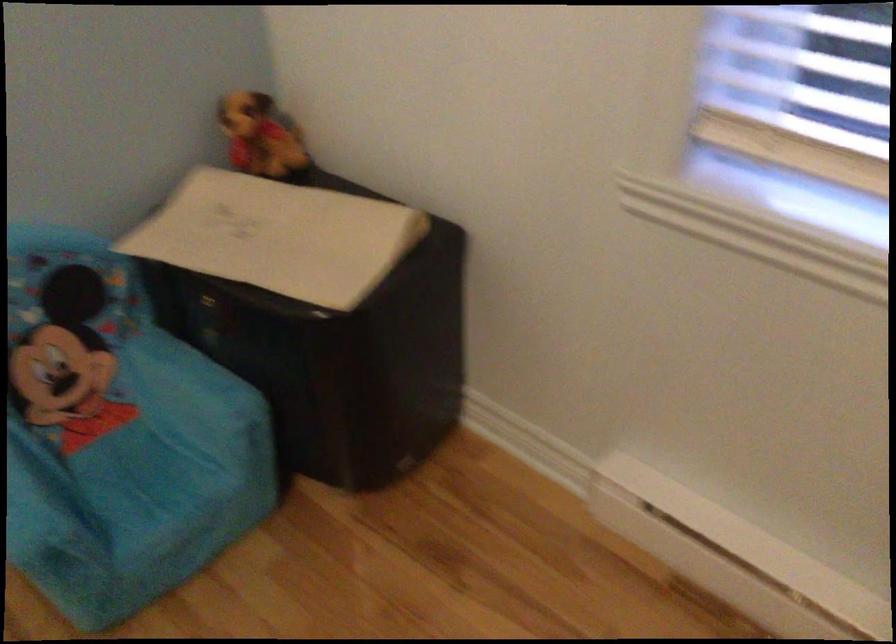
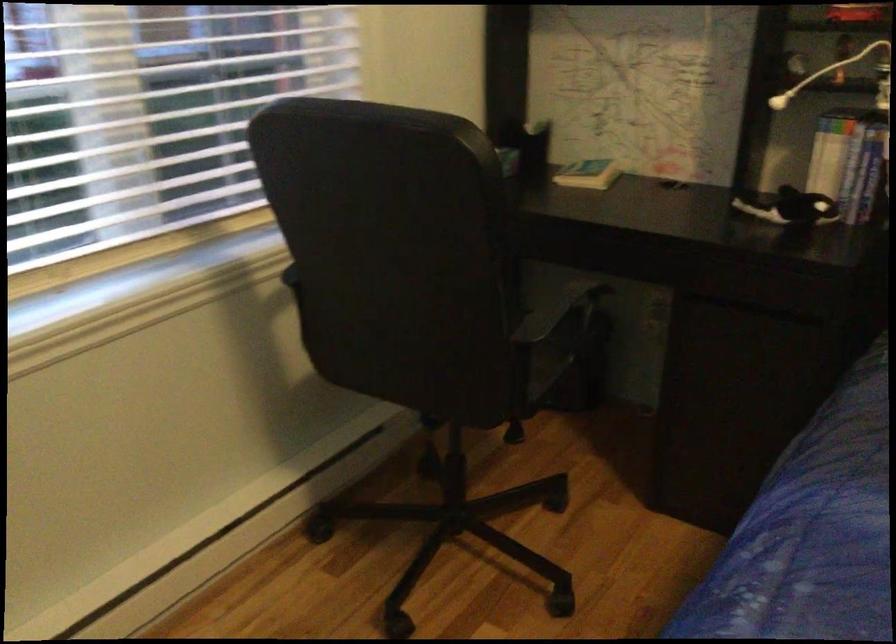
First-person continuous shooting, in which direction is the camera rotating?

The rotation direction of the camera is right-down.